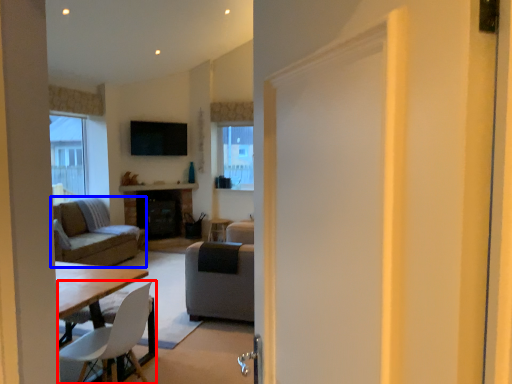
Question: Which point is further to the camera, chair (highlighted by a red box) or studio couch (highlighted by a blue box)?

Choices:
 (A) chair
 (B) studio couch

Answer: (B)